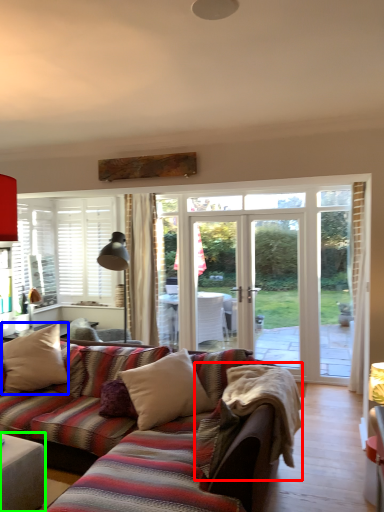
Question: Considering the real-world distances, which object is farthest from blanket (highlighted by a red box)? pillow (highlighted by a blue box) or table (highlighted by a green box)?

Choices:
 (A) pillow
 (B) table

Answer: (A)